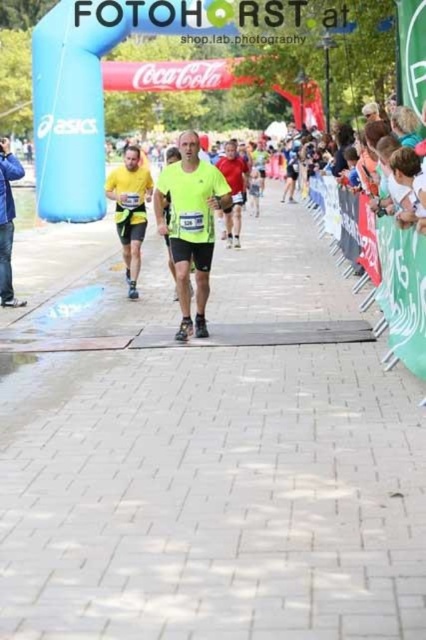
You are a spectator at the marathon finish line. You see two runners wearing a neon yellow running shirt at center and a matte red shirt at center. Which runner is closer to the left side of the finish line?

The neon yellow running shirt at center is positioned on the left side of matte red shirt at center, so the runner wearing the neon yellow running shirt at center is closer to the left side of the finish line.

You are a photographer at the marathon finish line. You need to capture a photo of both the neon yellow running shirt at center and the matte blue jacket at left. Which piece of clothing will appear taller in the photo?

The matte blue jacket at left will appear taller in the photo because it is taller than the neon yellow running shirt at center.

You are a photographer positioned at the finish line of the marathon. You want to capture a photo of both the matte blue jacket at left and the matte red shirt at center. Given that your camera has a maximum focus range of 15 feet, will you be able to focus on both subjects simultaneously?

The matte blue jacket at left is 17.12 feet away from the matte red shirt at center. Since the camera can only focus within 15 feet, the distance between them exceeds the focus range. Therefore, you cannot focus on both subjects simultaneously.